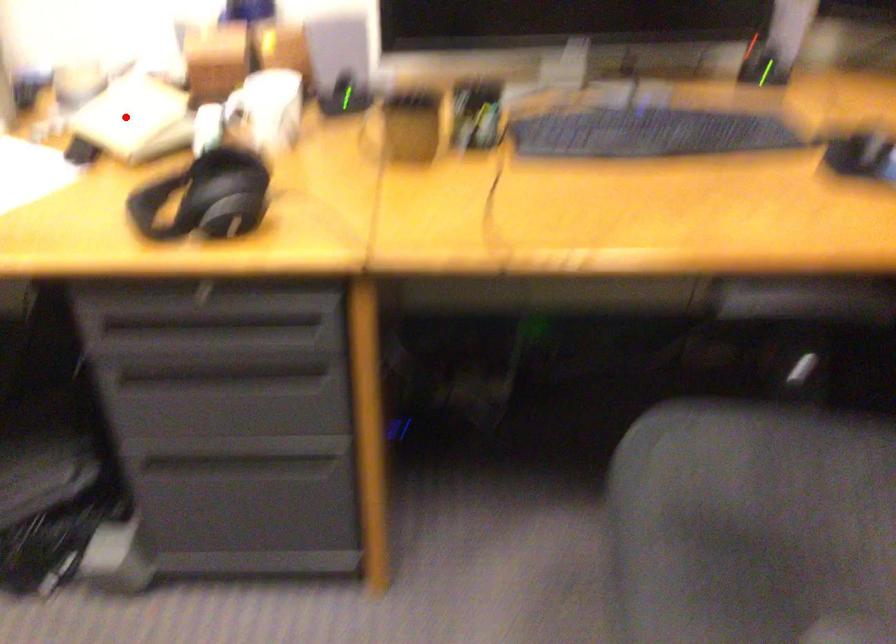
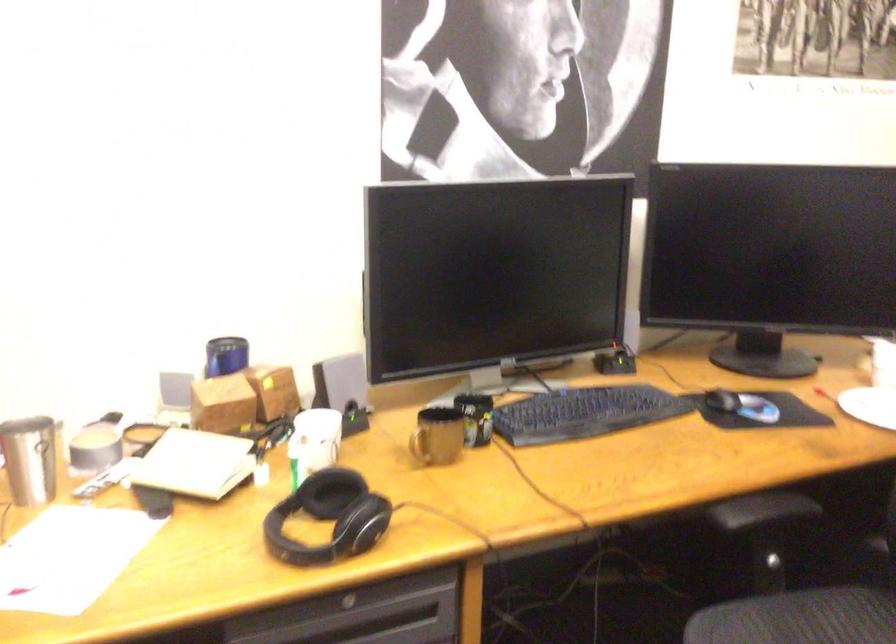
The point at the highlighted location is marked in the first image. Where is the corresponding point in the second image?

(194, 464)